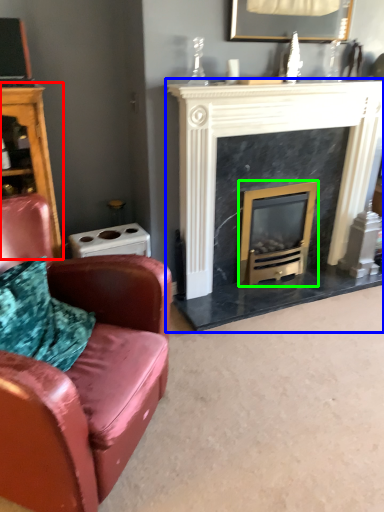
Question: Estimate the real-world distances between objects in this image. Which object is farther from dresser (highlighted by a red box), fireplace (highlighted by a blue box) or wood burning stove (highlighted by a green box)?

Choices:
 (A) fireplace
 (B) wood burning stove

Answer: (B)